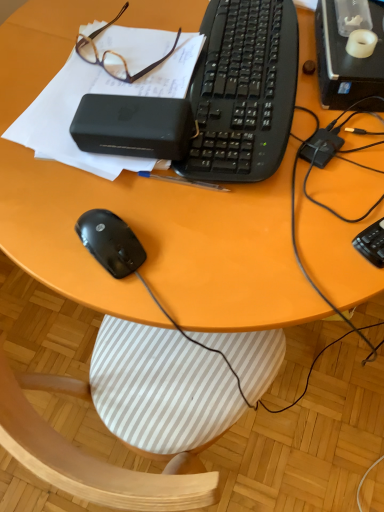
This screenshot has height=512, width=384. Find the location of `free space between black matte mouse at lower left and black plastic keyboard at right, which ranks as the second computer keyboard in top-to-bottom order`. free space between black matte mouse at lower left and black plastic keyboard at right, which ranks as the second computer keyboard in top-to-bottom order is located at coordinates (256, 233).